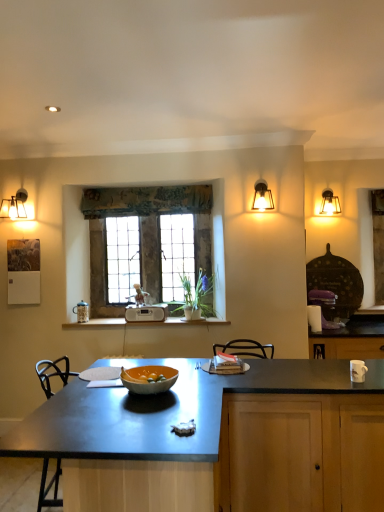
Question: Is textured fabric curtain at upper center spatially inside matte glass sconce at upper right, or outside of it?

Choices:
 (A) outside
 (B) inside

Answer: (A)

Question: Does point (119, 215) appear closer or farther from the camera than point (263, 206)?

Choices:
 (A) farther
 (B) closer

Answer: (A)

Question: Which object is the closest to the white wood window sill at center?

Choices:
 (A) white plastic radio at center
 (B) orange matte glass bowl at center
 (C) stained glass window at center
 (D) textured fabric curtain at upper center
 (E) metallic gray countertop at center

Answer: (A)

Question: Based on their relative distances, which object is farther from the metallic glass lampshade at upper right?

Choices:
 (A) matte glass sconce at upper right
 (B) textured fabric curtain at upper center
 (C) white plastic radio at center
 (D) white wood window sill at center
 (E) orange matte glass bowl at center

Answer: (E)